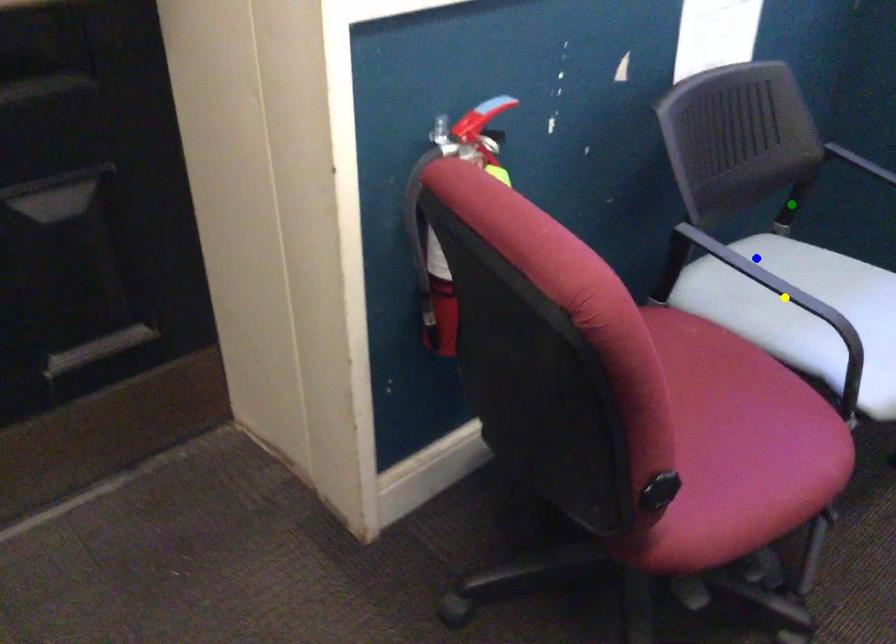
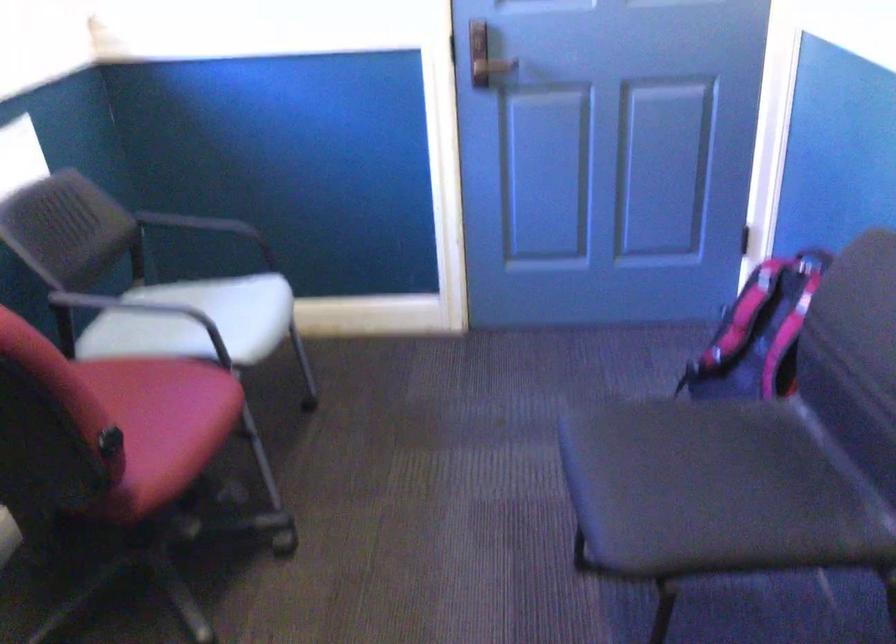
I am providing you with two images of the same scene from different viewpoints. Three points are marked in image1. Which point corresponds to a part or object that is occluded in image2?In image1, three points are marked. Which of them correspond to a part or object that is occluded in image2?Among the three points shown in image1, which one corresponds to a part or object that is no longer visible due to occlusion in image2?

yellow point